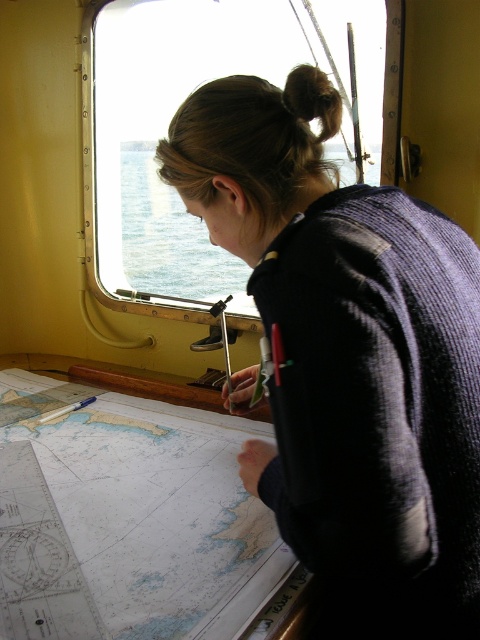
Based on the scene, which object, the clear glass window at upper center or the brown hair at upper center, occupies a larger vertical space in the image?

The clear glass window at upper center has a greater height compared to the brown hair at upper center, so it occupies a larger vertical space.

You are a sailor trying to navigate using the chart. There are two points marked on the chart at coordinates point (207,289) and point (332,116). Which point is closer to the camera?

Point (332,116) is closer to the camera because point (207,289) is behind it.

You are a sailor trying to decide whether to wear your dark blue sweater at center over your uniform. You notice the clear glass window at upper center nearby. Which item is narrower in width?

The dark blue sweater at center is thinner than the clear glass window at upper center, so the dark blue sweater at center is narrower in width.